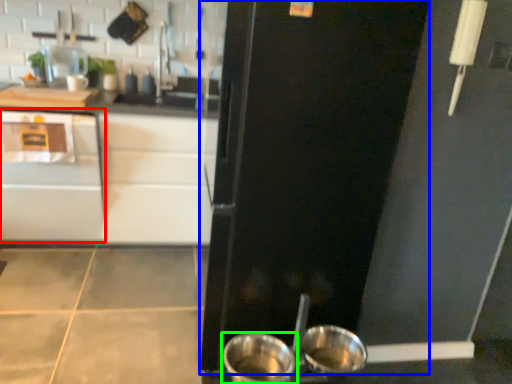
Question: Estimate the real-world distances between objects in this image. Which object is closer to cabinetry (highlighted by a red box), door (highlighted by a blue box) or kitchen appliance (highlighted by a green box)?

Choices:
 (A) door
 (B) kitchen appliance

Answer: (A)